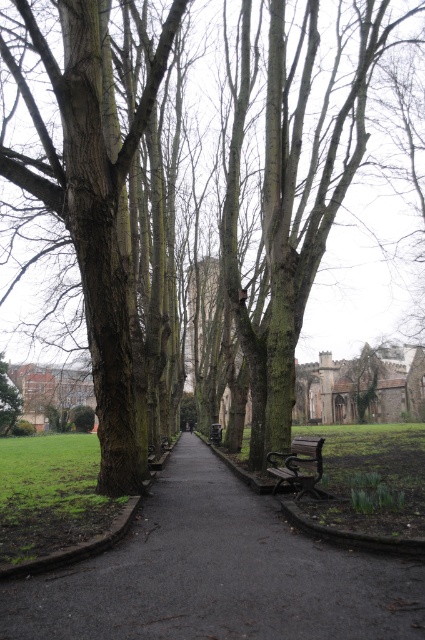
Question: Which point appears farthest from the camera in this image?

Choices:
 (A) (59, 209)
 (B) (345, 145)
 (C) (0, 412)

Answer: (C)

Question: Which of the following is the closest to the observer?

Choices:
 (A) green rough bark tree at left
 (B) green mossy bark tree at center
 (C) dark brown bark tree at left
 (D) wooden bench at center

Answer: (C)

Question: Is dark brown bark tree at left below green rough bark tree at left?

Choices:
 (A) yes
 (B) no

Answer: (B)

Question: Considering the real-world distances, which object is closest to the wooden bench at center?

Choices:
 (A) black asphalt path at center
 (B) green rough bark tree at left
 (C) dark brown bark tree at left
 (D) green mossy bark tree at center

Answer: (A)

Question: Observing the image, what is the correct spatial positioning of dark brown bark tree at left in reference to wooden bench at center?

Choices:
 (A) right
 (B) left

Answer: (B)

Question: Observing the image, what is the correct spatial positioning of black asphalt path at center in reference to green rough bark tree at left?

Choices:
 (A) left
 (B) right

Answer: (B)